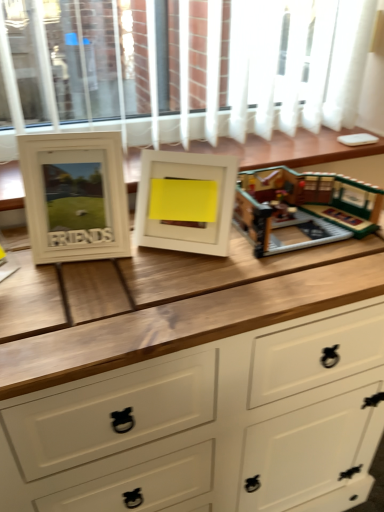
Question: Can you confirm if white wooden buffet at center is smaller than white matte picture frame at left, the 2th picture frame positioned from the right?

Choices:
 (A) no
 (B) yes

Answer: (A)

Question: Does white wooden buffet at center have a greater width compared to white matte picture frame at left, the first picture frame when ordered from left to right?

Choices:
 (A) yes
 (B) no

Answer: (A)

Question: Is white wooden buffet at center at the right side of white matte picture frame at left, the first picture frame when ordered from left to right?

Choices:
 (A) yes
 (B) no

Answer: (A)

Question: Would you say white wooden buffet at center contains white matte picture frame at left, the 2th picture frame positioned from the right?

Choices:
 (A) yes
 (B) no

Answer: (B)

Question: Is white wooden buffet at center taller than white matte picture frame at left, the 2th picture frame positioned from the right?

Choices:
 (A) no
 (B) yes

Answer: (A)

Question: From a real-world perspective, is white wooden buffet at center located higher than white matte picture frame at left, the 2th picture frame positioned from the right?

Choices:
 (A) no
 (B) yes

Answer: (A)

Question: From a real-world perspective, is white wood chest of drawers at center below white matte picture frame at left, the first picture frame when ordered from left to right?

Choices:
 (A) yes
 (B) no

Answer: (A)

Question: Is white wood chest of drawers at center placed right next to white matte picture frame at left, the 2th picture frame positioned from the right?

Choices:
 (A) yes
 (B) no

Answer: (B)

Question: Is the depth of white wood chest of drawers at center greater than that of white matte picture frame at left, the first picture frame when ordered from left to right?

Choices:
 (A) no
 (B) yes

Answer: (A)

Question: Considering the relative sizes of white wood chest of drawers at center and white matte picture frame at left, the first picture frame when ordered from left to right, in the image provided, is white wood chest of drawers at center taller than white matte picture frame at left, the first picture frame when ordered from left to right,?

Choices:
 (A) no
 (B) yes

Answer: (B)

Question: Can you confirm if white wood chest of drawers at center is wider than white matte picture frame at left, the 2th picture frame positioned from the right?

Choices:
 (A) yes
 (B) no

Answer: (A)

Question: Is the position of white wood chest of drawers at center less distant than that of white matte picture frame at left, the 2th picture frame positioned from the right?

Choices:
 (A) no
 (B) yes

Answer: (B)

Question: Is white matte picture frame at center, which ranks as the second picture frame in left-to-right order, turned away from white matte picture frame at left, the first picture frame when ordered from left to right?

Choices:
 (A) no
 (B) yes

Answer: (A)